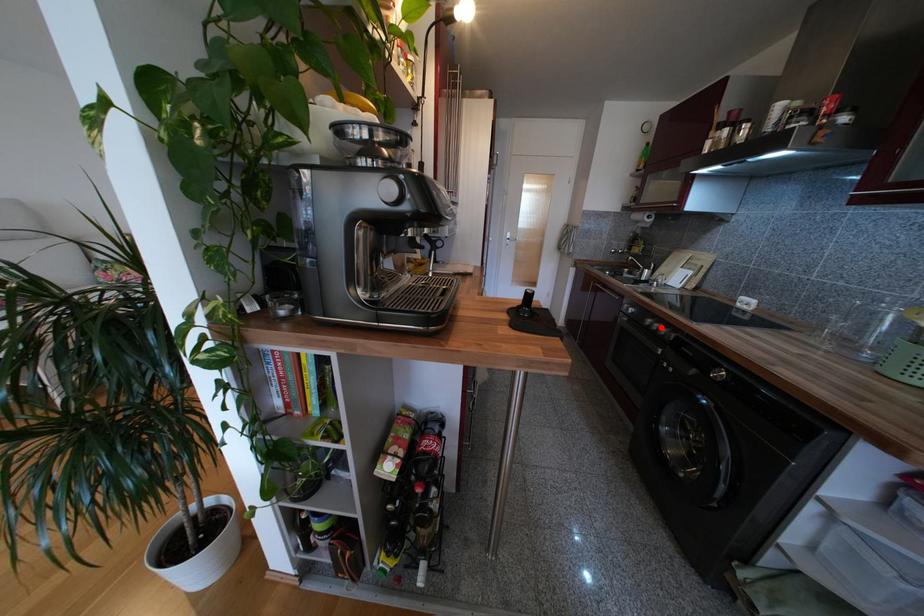
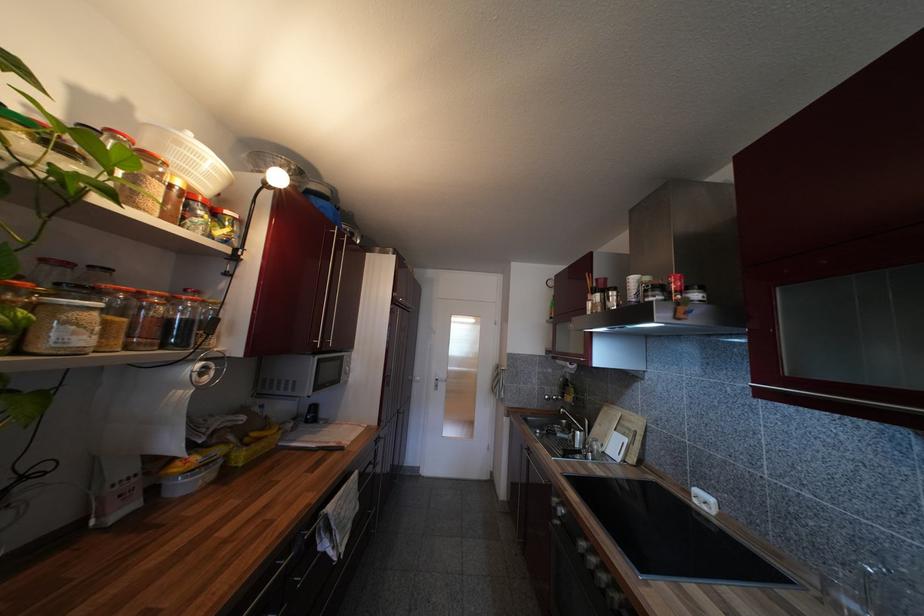
Question: I am providing you with two images of the same scene from different viewpoints. Image1 has a red point marked. In image2, the corresponding 3D location appears at what relative position? Reply with the corresponding letter.

Choices:
 (A) Closer
 (B) Farther

Answer: (B)